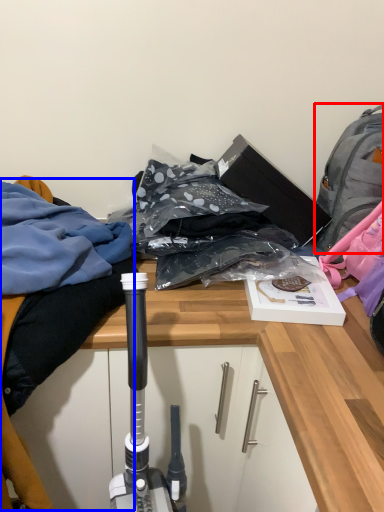
Question: Among these objects, which one is farthest to the camera, backpack (highlighted by a red box) or clothing (highlighted by a blue box)?

Choices:
 (A) backpack
 (B) clothing

Answer: (A)